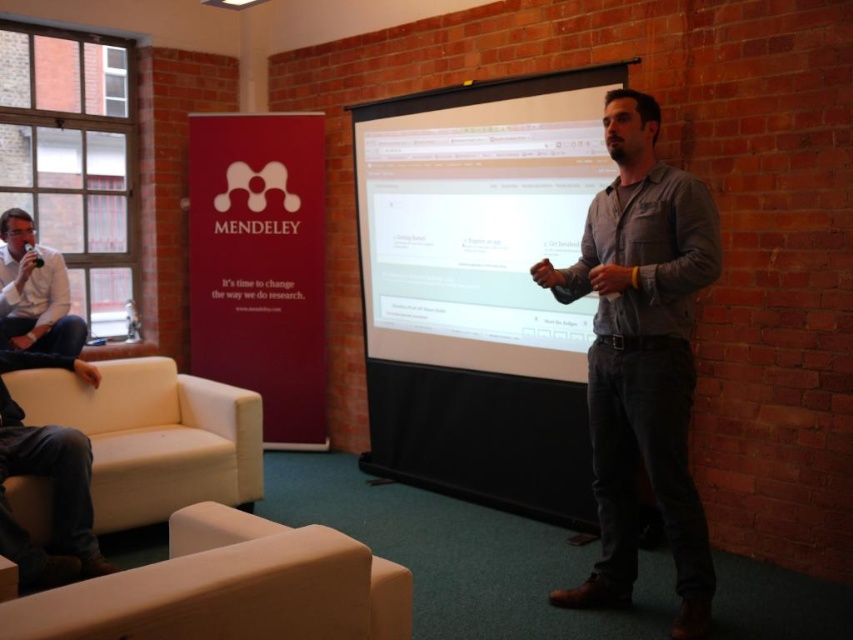
Question: Which object is the closest to the white glossy projection screen at center?

Choices:
 (A) gray cotton shirt at center
 (B) white shirt at left

Answer: (A)

Question: Does white glossy projection screen at center have a lesser width compared to white leather armchair at lower left?

Choices:
 (A) yes
 (B) no

Answer: (B)

Question: Which point appears farthest from the camera in this image?

Choices:
 (A) (88, 426)
 (B) (25, 326)
 (C) (495, 84)

Answer: (B)

Question: Is white glossy projection screen at center wider than beige fabric armchair at lower left?

Choices:
 (A) yes
 (B) no

Answer: (A)

Question: Among these objects, which one is nearest to the camera?

Choices:
 (A) gray cotton shirt at center
 (B) beige fabric armchair at lower left

Answer: (B)

Question: Is the position of white glossy projection screen at center more distant than that of gray cotton shirt at center?

Choices:
 (A) no
 (B) yes

Answer: (B)